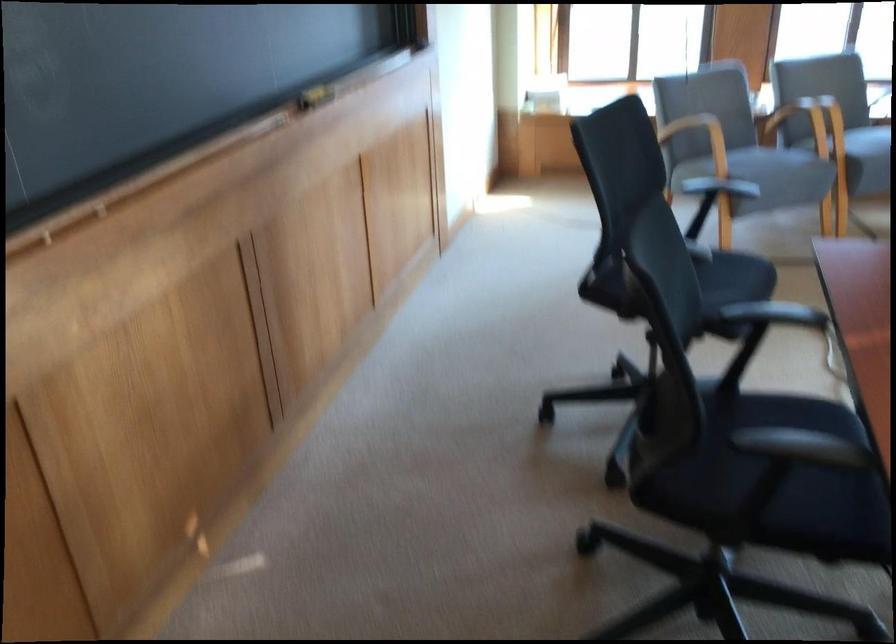
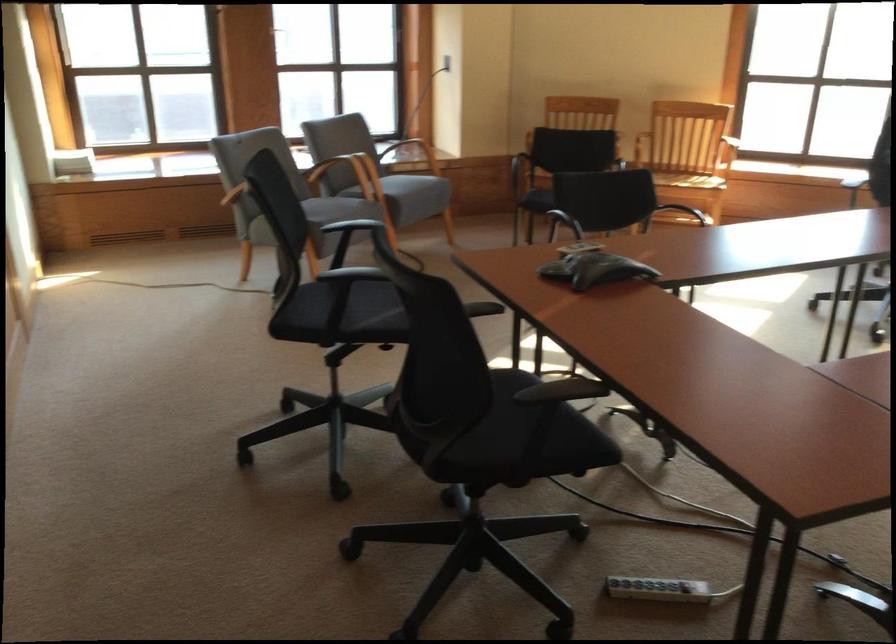
Question: I am providing you with two images of the same scene from different viewpoints. Which of the following objects are not visible in image2?

Choices:
 (A) wooden chair armrest
 (B) white power strip
 (C) black and green shoe
 (D) grey chair sitting surface

Answer: (A)